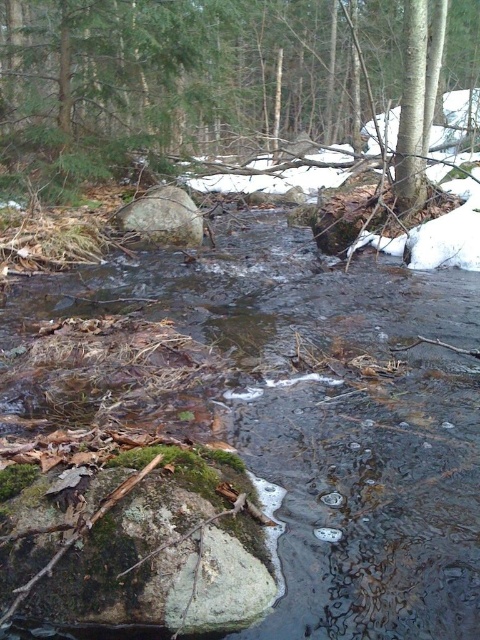
You are a hiker carrying a 2.5 meter wide tent. You want to set up camp between the clear water stream at center and the green mossy rock at center. Is there enough space to place your tent there?

The clear water stream at center and green mossy rock at center are 7.03 meters apart. Since the tent is 2.5 meters wide, there is sufficient space between them to place the tent as the distance is greater than the tent width.

You are standing in the forest and want to cross the stream. You see the clear water stream at center and the gray rough boulder at center. Which object should you step on to cross the stream safely?

The gray rough boulder at center is a safer option to cross the stream because it is positioned to the left of the stream, providing a stable surface to step on.